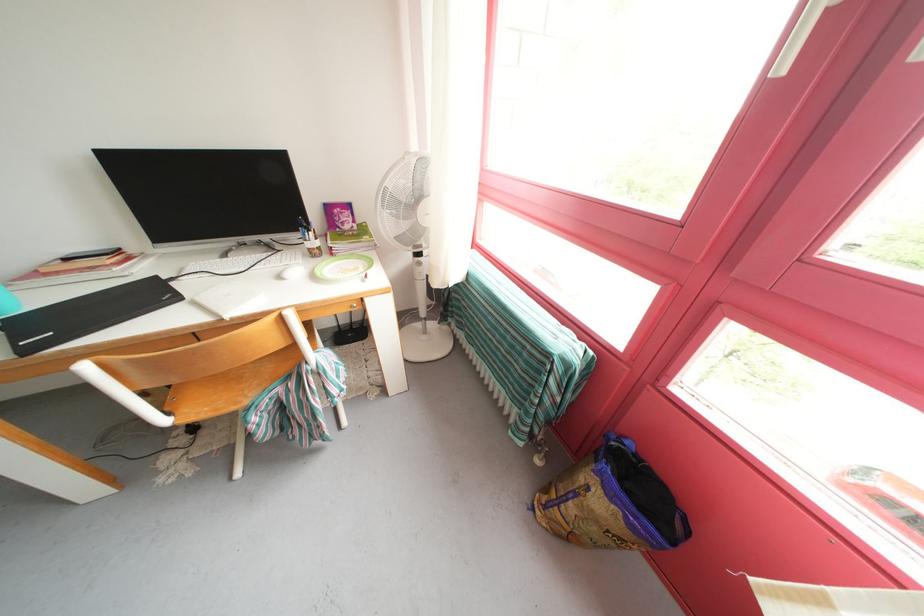
Identify the location of chair sitting surface. (209, 397).